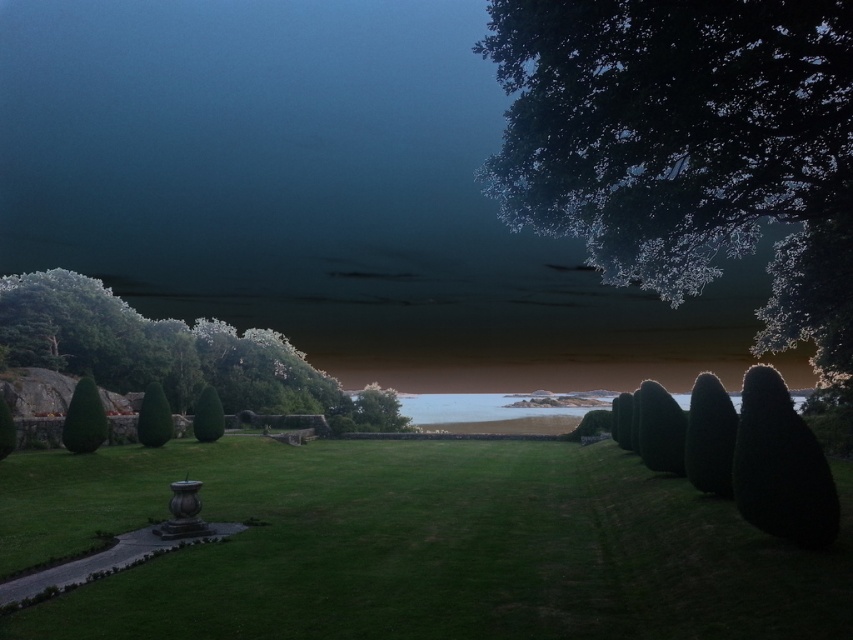
You are standing at the entrance of the garden and see the green leafy tree at lower left and the green textured hedge at lower left. Which one is higher up in the image?

The green leafy tree at lower left is located above the green textured hedge at lower left, so the green leafy tree at lower left is higher up in the image.